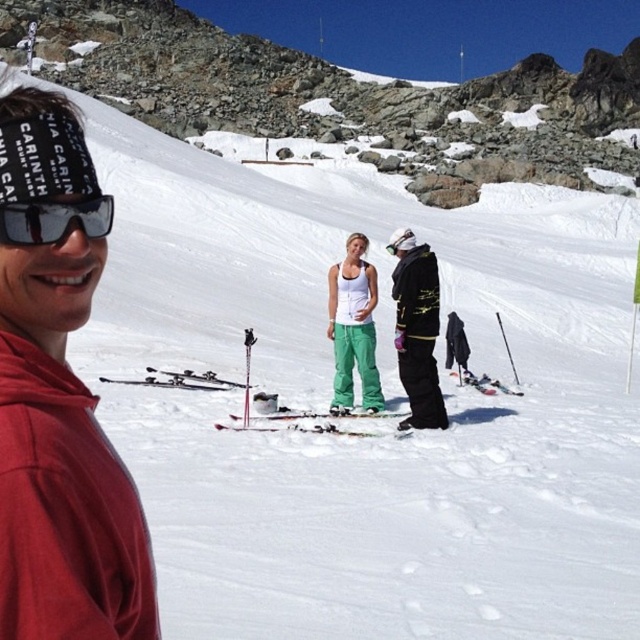
You are a photographer trying to capture a group photo of the red fabric headband at upper left and the white matte tank top at center. Based on their positions, which object should you focus on first to ensure both are in frame?

The red fabric headband at upper left is taller than the white matte tank top at center, so you should focus on the red fabric headband at upper left first to ensure both are in frame.

You are a drone operator trying to capture a photo of the two skiers in the background. The camera can only focus on objects at a specific distance. If you position the camera at point (113, 513), will the skiers at point (60, 234) be in focus?

Point (113, 513) is in front of point (60, 234), so the skiers at point (60, 234) are behind the camera position. Therefore, they will not be in focus if the camera is focused at point (113, 513).

You are a photographer trying to focus on the red fabric headband at upper left. What are the coordinates where you should aim your camera?

The red fabric headband at upper left is located at coordinates point (58, 397).